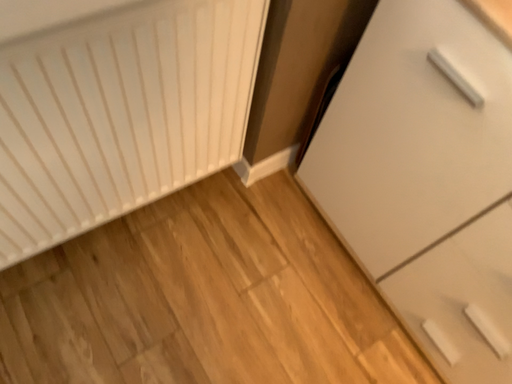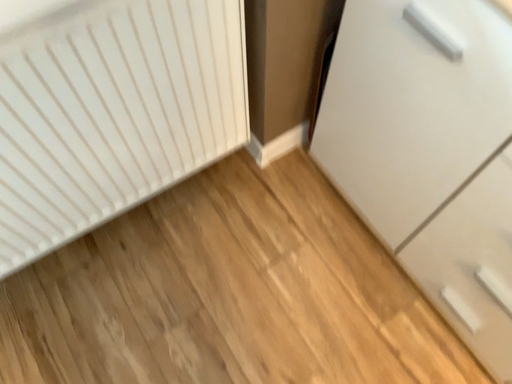
Question: How did the camera likely rotate when shooting the video?

Choices:
 (A) rotated right
 (B) rotated left

Answer: (B)